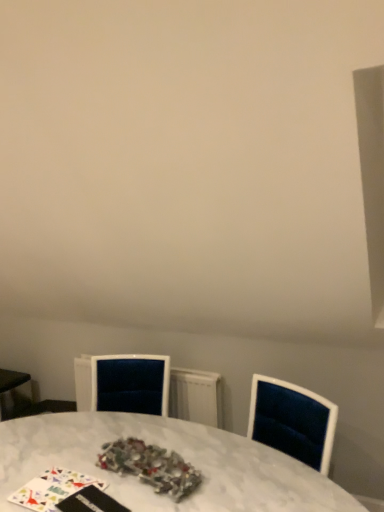
At what (x,y) coordinates should I click in order to perform the action: click on free point to the left of shiny metallic tinsel at center. Please return your answer as a coordinate pair (x, y). Looking at the image, I should click on (69, 467).